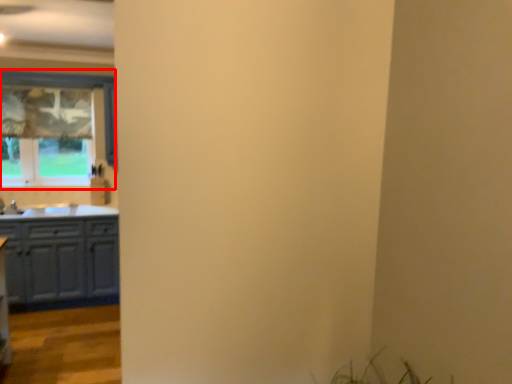
Question: From the image's perspective, where is window (annotated by the red box) located relative to cabinetry?

Choices:
 (A) below
 (B) above

Answer: (B)